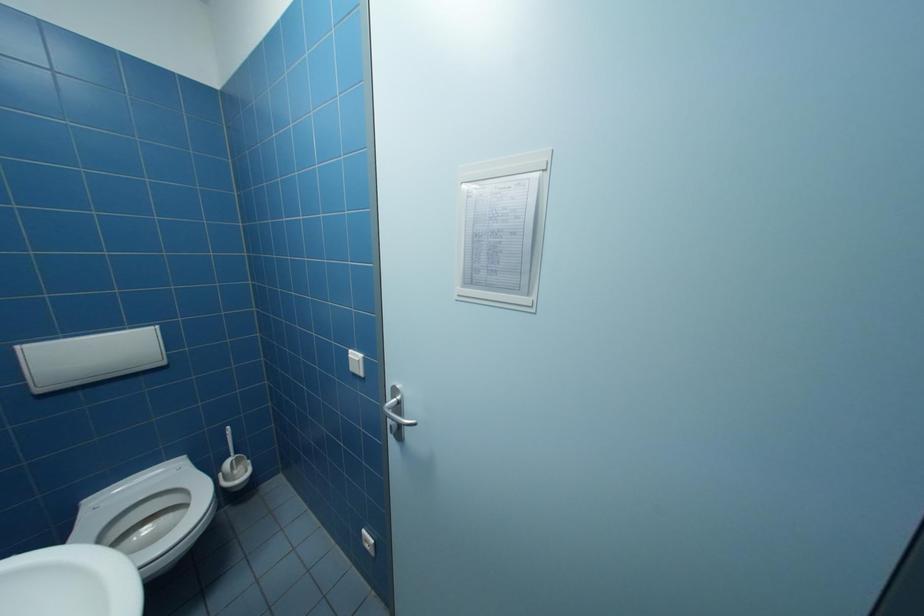
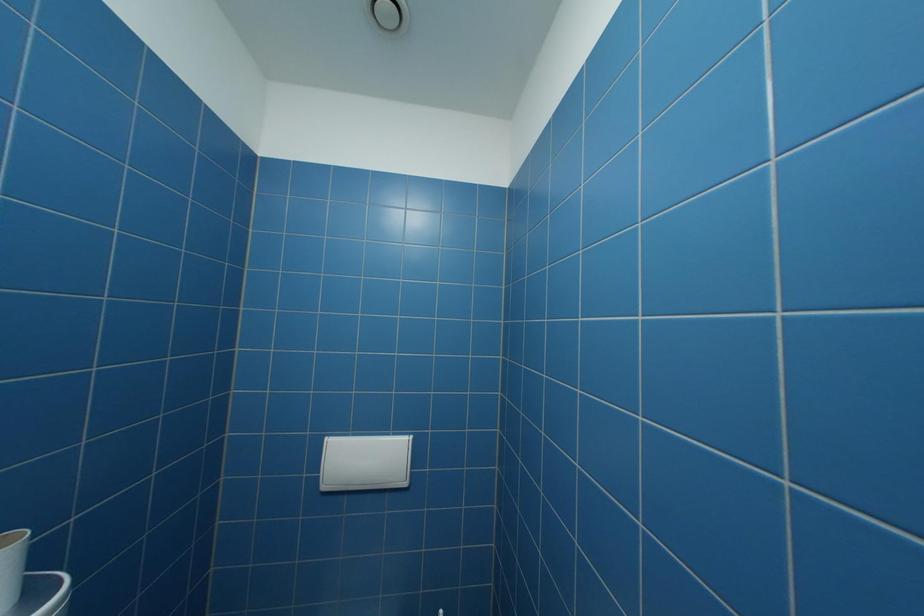
Question: The camera is either moving clockwise (left) or counter-clockwise (right) around the object. The first image is from the beginning of the video and the second image is from the end. Is the camera moving left or right when shooting the video?

Choices:
 (A) Left
 (B) Right

Answer: (B)